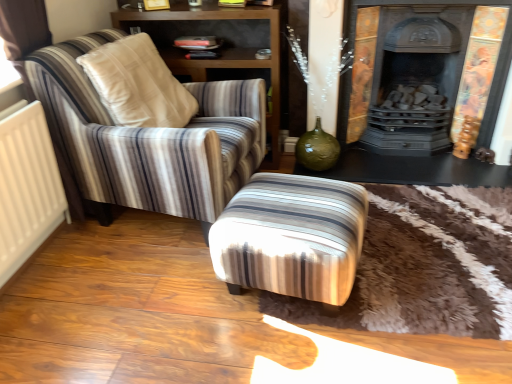
Where is `vacant location below dark gray cast iron fireplace at upper right (from a real-world perspective)`? vacant location below dark gray cast iron fireplace at upper right (from a real-world perspective) is located at coordinates (401, 159).